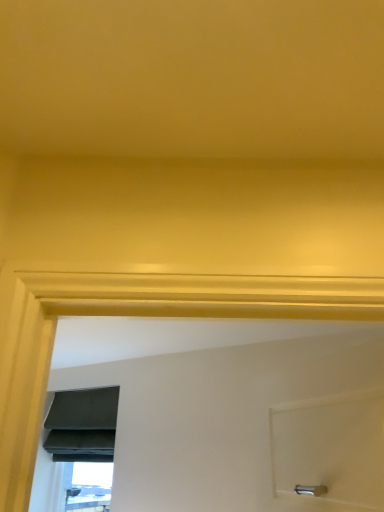
Question: Looking at the image, does matte black window at lower left, the 1th window in the bottom-to-top sequence, seem bigger or smaller compared to matte gray fabric at lower left, which is the 1th window from top to bottom?

Choices:
 (A) big
 (B) small

Answer: (B)

Question: Considering the positions of matte black window at lower left, the 1th window in the bottom-to-top sequence, and matte gray fabric at lower left, which is the second window from bottom to top, in the image, is matte black window at lower left, the 1th window in the bottom-to-top sequence, wider or thinner than matte gray fabric at lower left, which is the second window from bottom to top,?

Choices:
 (A) wide
 (B) thin

Answer: (B)

Question: From a real-world perspective, is matte black window at lower left, which is counted as the 2th window, starting from the top, physically located above or below matte gray fabric at lower left, which is the 1th window from top to bottom?

Choices:
 (A) above
 (B) below

Answer: (B)

Question: Visually, is matte gray fabric at lower left, which is the 1th window from top to bottom, positioned to the left or to the right of matte black window at lower left, which is counted as the 2th window, starting from the top?

Choices:
 (A) right
 (B) left

Answer: (B)

Question: In terms of height, does matte gray fabric at lower left, which is the 1th window from top to bottom, look taller or shorter compared to matte black window at lower left, the 1th window in the bottom-to-top sequence?

Choices:
 (A) short
 (B) tall

Answer: (B)

Question: Looking at their shapes, would you say matte gray fabric at lower left, which is the second window from bottom to top, is wider or thinner than matte black window at lower left, which is counted as the 2th window, starting from the top?

Choices:
 (A) wide
 (B) thin

Answer: (A)

Question: Is point (109, 443) positioned closer to the camera than point (77, 498)?

Choices:
 (A) closer
 (B) farther

Answer: (A)